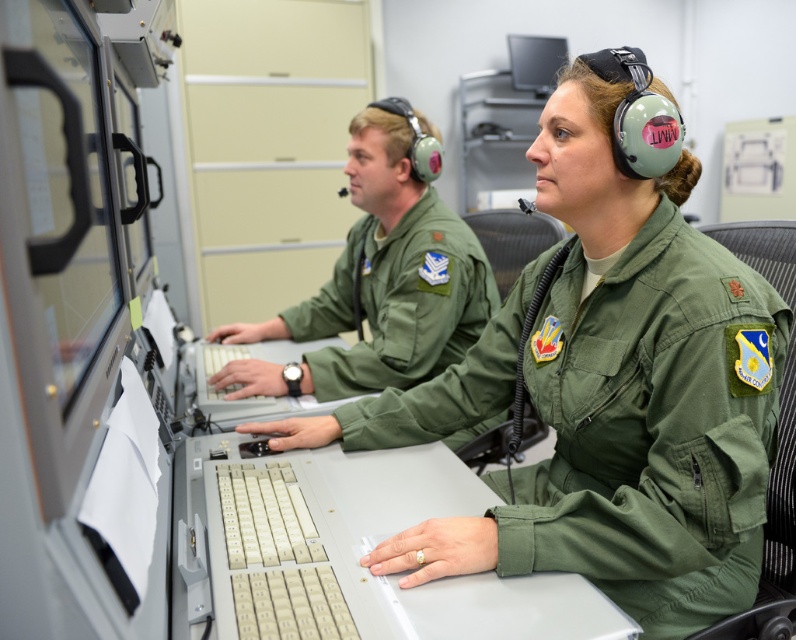
You are a new recruit trying to set up your workstation. You need to place a new headset between the green fabric uniform at center and the black glossy monitor at upper center. According to the current setup, where should you place the headset so it doesn

The green fabric uniform at center is positioned under the black glossy monitor at upper center, so you should place the headset between them by positioning it below the monitor and above the uniform.

You are a technician needing to access the black glossy monitor at upper center for maintenance. However, there is a green fabric uniform at center in the way. Based on their positions, can you reach the monitor without moving the uniform?

The green fabric uniform at center is closer to the viewer than the black glossy monitor at upper center, so you can reach the monitor without moving the uniform because it is behind the uniform.